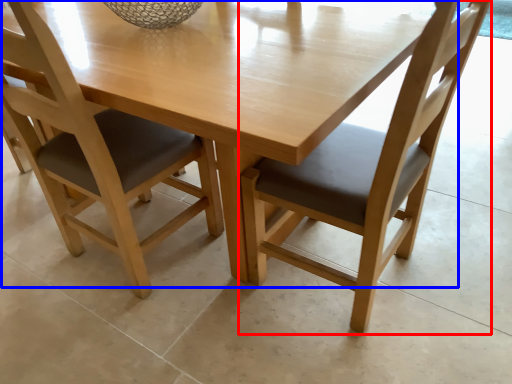
Question: Which object is closer to the camera taking this photo, chair (highlighted by a red box) or round table (highlighted by a blue box)?

Choices:
 (A) chair
 (B) round table

Answer: (A)